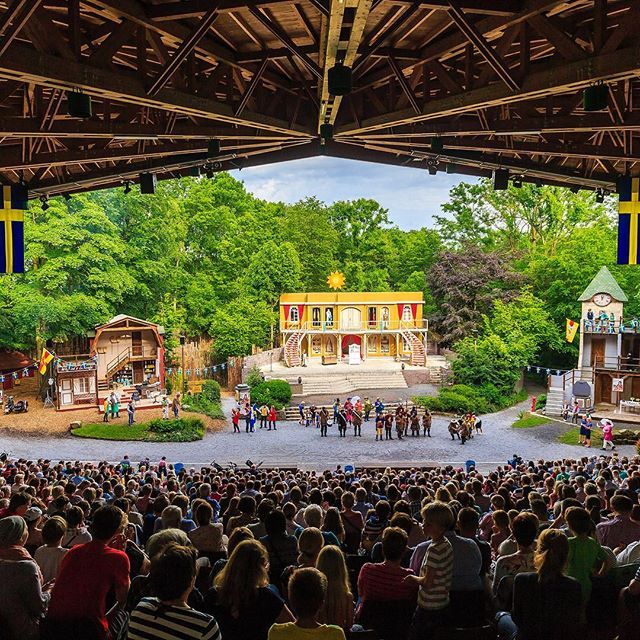
I want to click on stairs, so tap(415, 352), tap(290, 348), tap(324, 380), tap(364, 378), tap(550, 399), tap(102, 380).